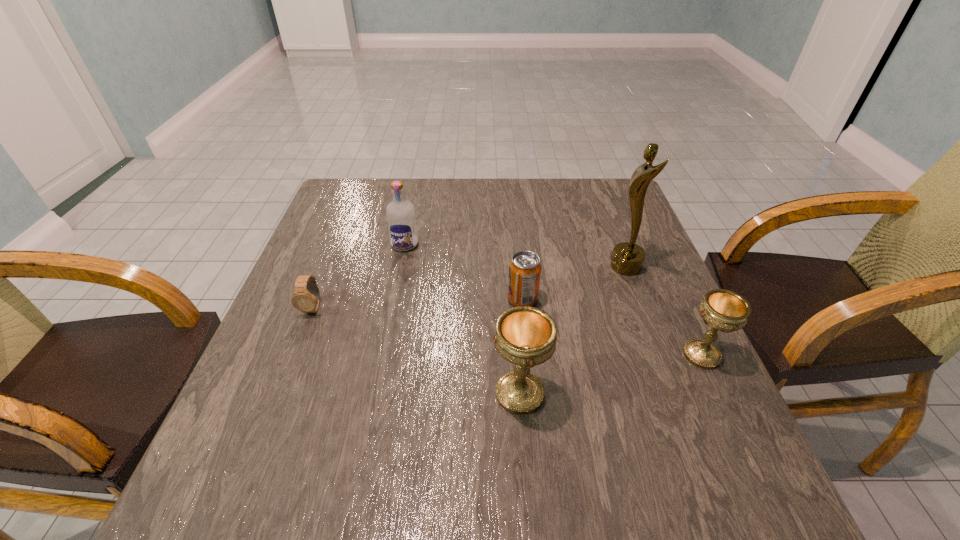
Image resolution: width=960 pixels, height=540 pixels. What are the coordinates of `vacant point that satisfies the following two spatial constraints: 1. on the label of the second object from left to right; 2. on the right side of the soda can` in the screenshot? It's located at (394, 299).

Find the location of `free space that satisfies the following two spatial constraints: 1. on the label of the fourth tallest object; 2. on the right side of the fifth object from right to left`. free space that satisfies the following two spatial constraints: 1. on the label of the fourth tallest object; 2. on the right side of the fifth object from right to left is located at coordinates (382, 355).

The image size is (960, 540). In order to click on free spot that satisfies the following two spatial constraints: 1. on the label of the fifth object from right to left; 2. on the right side of the soda can in this screenshot , I will do `click(394, 299)`.

Where is `free space that satisfies the following two spatial constraints: 1. on the label of the fifth tallest object; 2. on the right side of the vodka`? This screenshot has height=540, width=960. free space that satisfies the following two spatial constraints: 1. on the label of the fifth tallest object; 2. on the right side of the vodka is located at coordinates (394, 299).